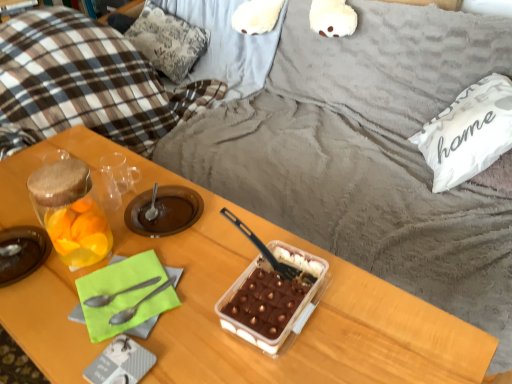
I want to click on vacant point to the left of black plastic spoon at center, the third spoon from the left, so click(x=205, y=267).